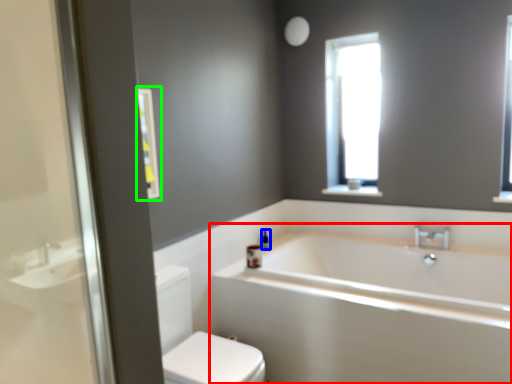
Question: Estimate the real-world distances between objects in this image. Which object is closer to bathtub (highlighted by a red box), toiletry (highlighted by a blue box) or medicine cabinet (highlighted by a green box)?

Choices:
 (A) toiletry
 (B) medicine cabinet

Answer: (A)